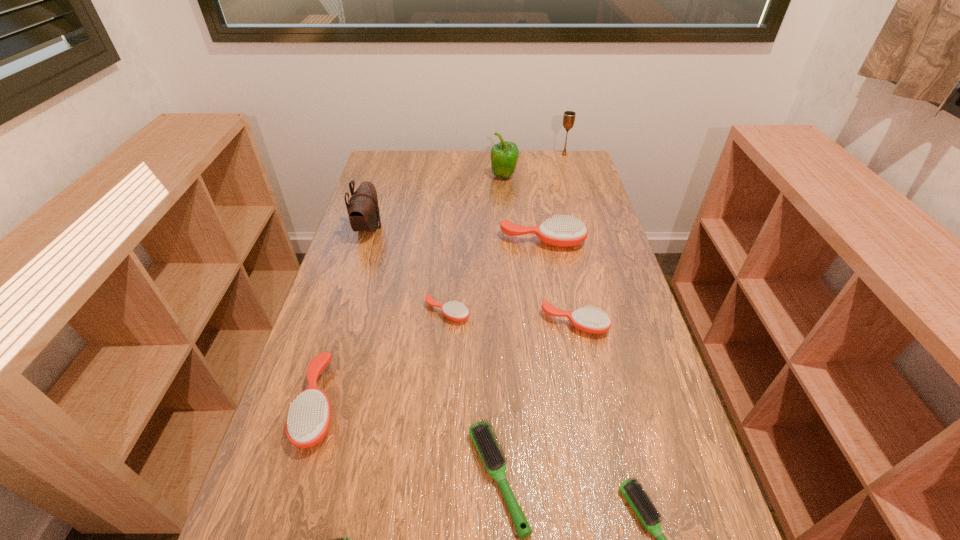
What are the coordinates of `bell pepper present at the far edge` in the screenshot? It's located at (504, 155).

The image size is (960, 540). Identify the location of pouch present at the left edge. (363, 209).

You are a GUI agent. You are given a task and a screenshot of the screen. Output one action in this format:
    pyautogui.click(x=<x>, y=<y>)
    Task: Click on the hairbrush that is at the left edge
    Image resolution: width=960 pixels, height=540 pixels.
    Given the screenshot: What is the action you would take?
    pyautogui.click(x=308, y=420)

Locate an element on the screen. chalice at the right edge is located at coordinates (569, 116).

I want to click on object present at the far right corner, so click(x=569, y=116).

The image size is (960, 540). In the image, there is a desktop. Identify the location of free region at the far edge. (420, 160).

At what (x,y) coordinates should I click in order to perform the action: click on vacant position at the left edge of the desktop. Please return your answer as a coordinate pair (x, y). This screenshot has width=960, height=540. Looking at the image, I should click on (377, 195).

This screenshot has height=540, width=960. In the image, there is a desktop. Identify the location of free space at the right edge. (665, 404).

This screenshot has width=960, height=540. I want to click on vacant space at the far left corner of the desktop, so click(x=387, y=181).

Image resolution: width=960 pixels, height=540 pixels. In the image, there is a desktop. Identify the location of vacant space at the far right corner. (563, 168).